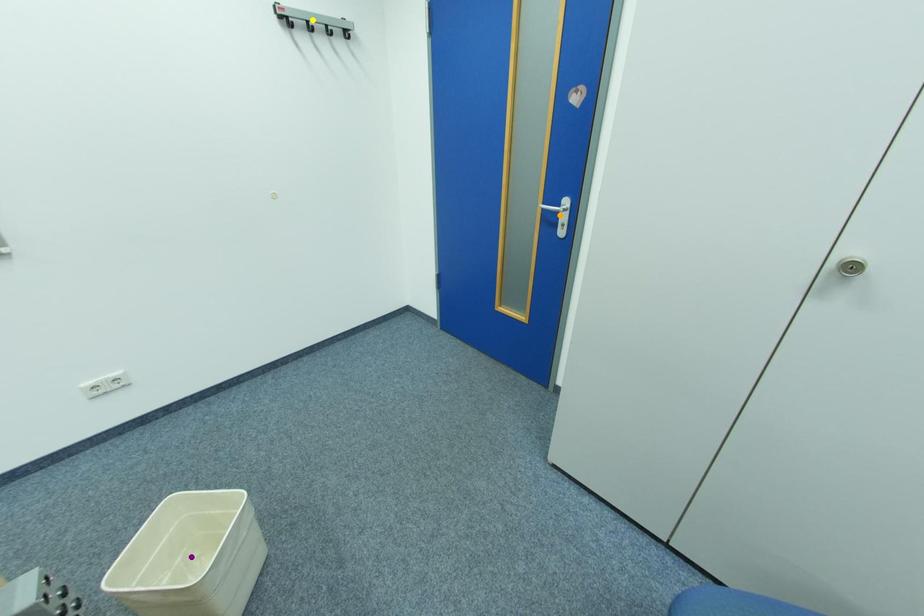
Order these from nearest to farthest:
purple point, orange point, yellow point

1. purple point
2. yellow point
3. orange point